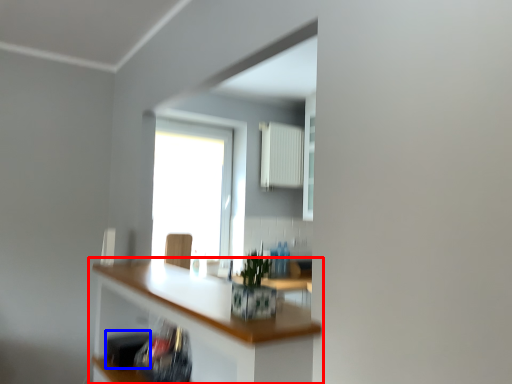
Question: Which object is further to the camera taking this photo, countertop (highlighted by a red box) or appliance (highlighted by a blue box)?

Choices:
 (A) countertop
 (B) appliance

Answer: (B)